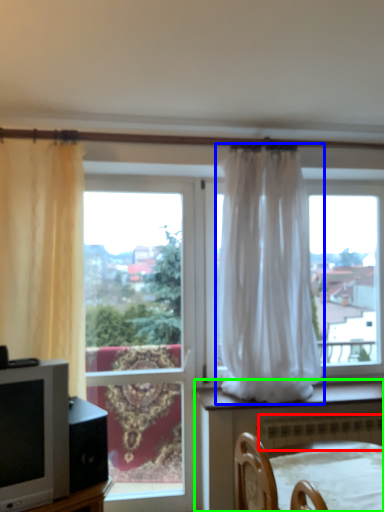
Question: Estimate the real-world distances between objects in this image. Which object is farther from radiator (highlighted by a red box), curtain (highlighted by a blue box) or furniture (highlighted by a green box)?

Choices:
 (A) curtain
 (B) furniture

Answer: (A)